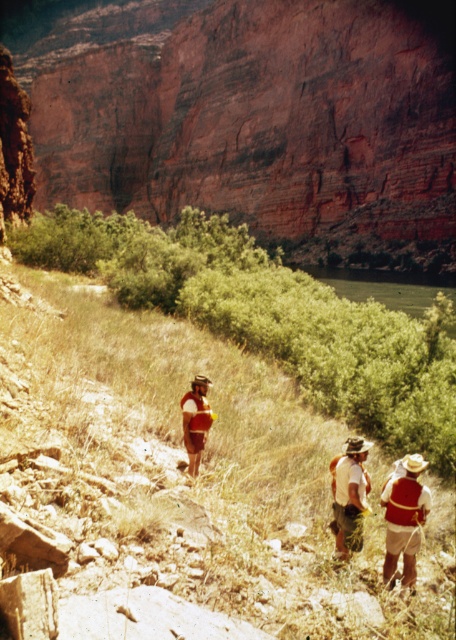
You are a hiker planning to take a photo of the white fabric shirt at lower center and the matte red backpack at center. Which object should you focus on first if you want to capture both in the same frame without moving the camera?

You should focus on the matte red backpack at center first because the white fabric shirt at lower center is positioned to its right, so keeping the backpack centered will ensure both objects are within the frame.

You are a photographer positioned at the lower left corner of the image. You want to capture a photo of the white fabric shirt at lower center. Based on your position, is the shirt within your field of view?

The white fabric shirt at lower center is positioned at point (x=350, y=493), which is within the lower central area of the image. Since you are at the lower left corner, the shirt should be within your field of view as it is positioned towards the center from your perspective.